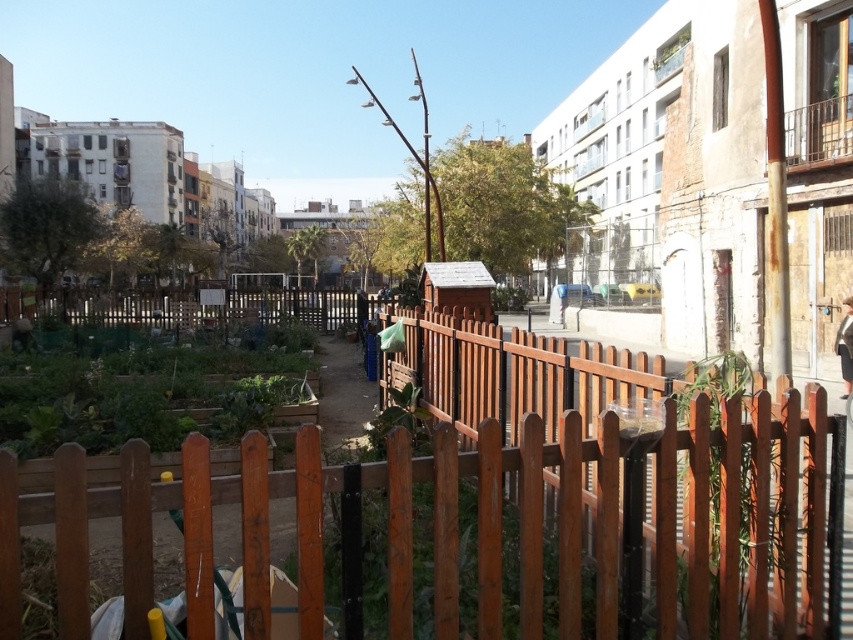
Is brown wooden fence at center thinner than green matte vegetable garden at lower left?

Correct, brown wooden fence at center's width is less than green matte vegetable garden at lower left's.

Is brown wooden fence at center to the left of green matte vegetable garden at lower left from the viewer's perspective?

Incorrect, brown wooden fence at center is not on the left side of green matte vegetable garden at lower left.

Identify the location of brown wooden fence at center. Image resolution: width=853 pixels, height=640 pixels. (740, 509).